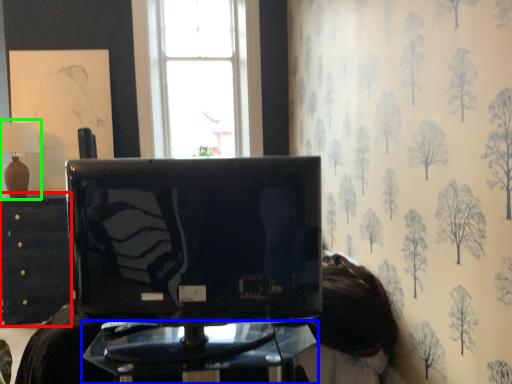
Question: Considering the real-world distances, which object is farthest from furniture (highlighted by a red box)? furniture (highlighted by a blue box) or table lamp (highlighted by a green box)?

Choices:
 (A) furniture
 (B) table lamp

Answer: (A)